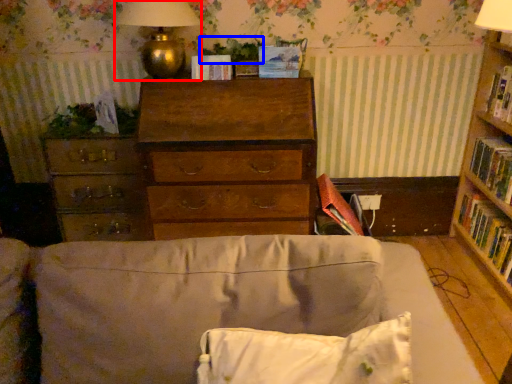
Question: Which object is closer to the camera taking this photo, table lamp (highlighted by a red box) or plant (highlighted by a blue box)?

Choices:
 (A) table lamp
 (B) plant

Answer: (A)